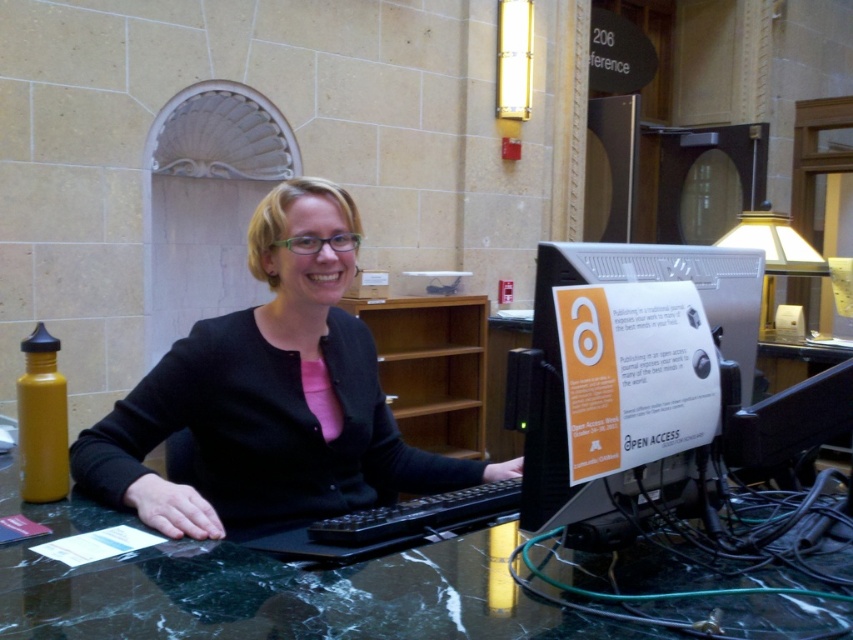
Is the position of black matte sweater at center more distant than that of silver metallic computer monitor at center?

Yes, it is behind silver metallic computer monitor at center.

Is black matte sweater at center bigger than silver metallic computer monitor at center?

Correct, black matte sweater at center is larger in size than silver metallic computer monitor at center.

Is point (288, 387) behind point (757, 253)?

That is True.

Identify the location of black matte sweater at center. (270, 397).

Does point (463, 608) come behind point (675, 262)?

No, (463, 608) is closer to viewer.

Between marble table at center and silver metallic computer monitor at center, which one appears on the left side from the viewer's perspective?

From the viewer's perspective, marble table at center appears more on the left side.

At what (x,y) coordinates should I click in order to perform the action: click on marble table at center. Please return your answer as a coordinate pair (x, y). Looking at the image, I should click on (270, 589).

Is the position of black matte sweater at center more distant than that of marble table at center?

Yes, it is behind marble table at center.

Who is more forward, (231, 336) or (13, 480)?

Point (13, 480) is in front.

Image resolution: width=853 pixels, height=640 pixels. Identify the location of black matte sweater at center. (270, 397).